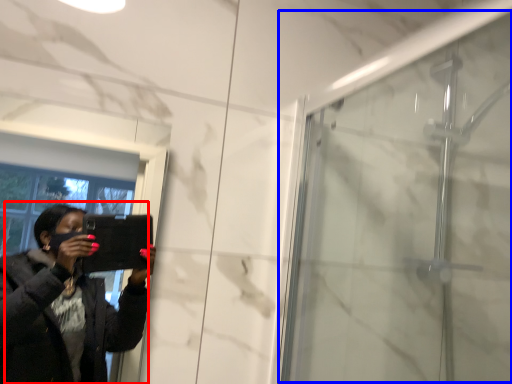
Question: Which object appears closest to the camera in this image, woman (highlighted by a red box) or screen door (highlighted by a blue box)?

Choices:
 (A) woman
 (B) screen door

Answer: (A)